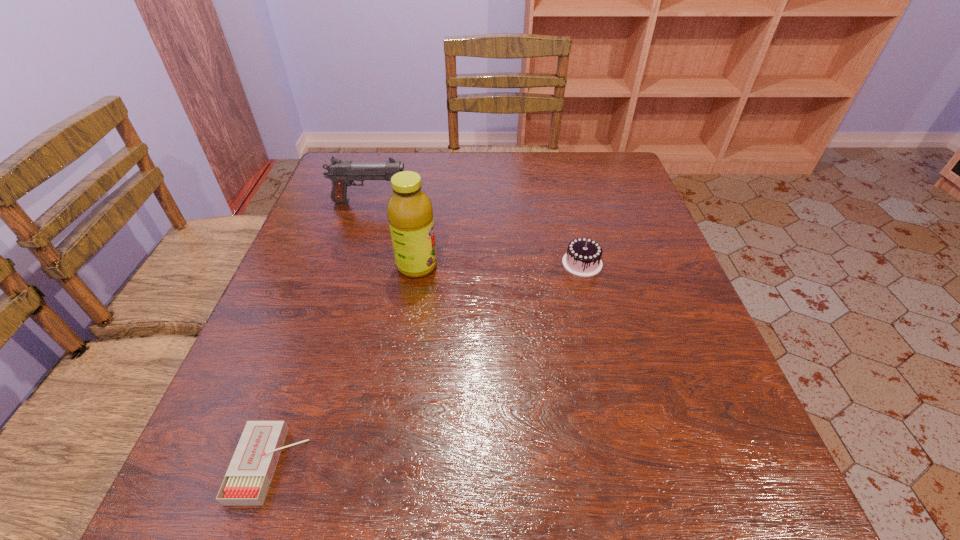
Identify the location of vacant space located 0.090m on the front of the chocolate cake. Image resolution: width=960 pixels, height=540 pixels. (593, 307).

Locate an element on the screen. This screenshot has height=540, width=960. vacant area located 0.330m on the striking surface of the nearest object is located at coordinates (521, 464).

I want to click on object that is at the near edge, so click(247, 480).

Where is `gun at the left edge`? gun at the left edge is located at coordinates (342, 173).

Find the location of a particular element. The image size is (960, 540). matchbox that is at the left edge is located at coordinates (247, 480).

Locate an element on the screen. The height and width of the screenshot is (540, 960). object that is at the right edge is located at coordinates coord(583,258).

Locate an element on the screen. object present at the near left corner is located at coordinates (247, 480).

Where is `vacant region at the far edge of the desktop`? vacant region at the far edge of the desktop is located at coordinates (448, 176).

What are the coordinates of `free space at the near edge of the desktop` in the screenshot? It's located at (333, 527).

Image resolution: width=960 pixels, height=540 pixels. Identify the location of vacant space at the left edge of the desktop. (x=244, y=368).